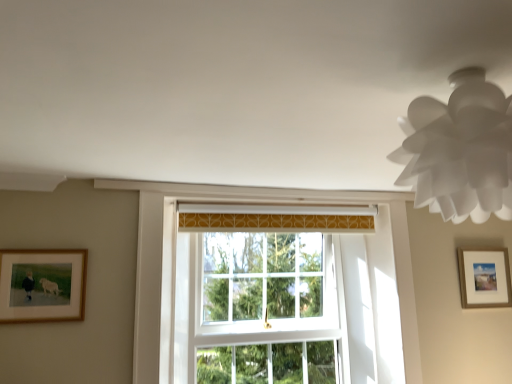
Question: Could you tell me if wooden framed picture at right, the first picture frame when ordered from back to front, is turned towards white paper lampshade at upper right?

Choices:
 (A) no
 (B) yes

Answer: (A)

Question: Would you say wooden framed picture at right, the second picture frame viewed from the left, contains white paper lampshade at upper right?

Choices:
 (A) no
 (B) yes

Answer: (A)

Question: Is wooden framed picture at right, the second picture frame viewed from the left, in front of white paper lampshade at upper right?

Choices:
 (A) no
 (B) yes

Answer: (A)

Question: Does wooden framed picture at right, the second picture frame viewed from the left, have a smaller size compared to white paper lampshade at upper right?

Choices:
 (A) yes
 (B) no

Answer: (A)

Question: Can you confirm if wooden framed picture at right, the second picture frame viewed from the left, is shorter than white paper lampshade at upper right?

Choices:
 (A) yes
 (B) no

Answer: (B)

Question: Is white glass window at center to the left or to the right of wooden framed picture at right, the first picture frame when ordered from back to front, in the image?

Choices:
 (A) right
 (B) left

Answer: (B)

Question: Is white glass window at center inside the boundaries of wooden framed picture at right, the first picture frame when ordered from back to front, or outside?

Choices:
 (A) outside
 (B) inside

Answer: (A)

Question: Is white glass window at center taller or shorter than wooden framed picture at right, positioned as the 2th picture frame in front-to-back order?

Choices:
 (A) short
 (B) tall

Answer: (B)

Question: In the image, is white glass window at center positioned in front of or behind wooden framed picture at right, the 1th picture frame positioned from the right?

Choices:
 (A) behind
 (B) front

Answer: (B)

Question: In the image, is wooden framed picture at right, the 1th picture frame positioned from the right, on the left side or the right side of wooden framed picture at left, which is the first picture frame in front-to-back order?

Choices:
 (A) right
 (B) left

Answer: (A)

Question: From the image's perspective, is wooden framed picture at right, positioned as the 2th picture frame in front-to-back order, above or below wooden framed picture at left, acting as the second picture frame starting from the back?

Choices:
 (A) above
 (B) below

Answer: (B)

Question: From a real-world perspective, is wooden framed picture at right, positioned as the 2th picture frame in front-to-back order, physically located above or below wooden framed picture at left, acting as the second picture frame starting from the back?

Choices:
 (A) above
 (B) below

Answer: (B)

Question: Does point (479, 256) appear closer or farther from the camera than point (0, 306)?

Choices:
 (A) closer
 (B) farther

Answer: (B)

Question: Would you say wooden framed picture at right, the 1th picture frame positioned from the right, is inside or outside white paper lampshade at upper right?

Choices:
 (A) inside
 (B) outside

Answer: (B)

Question: Is wooden framed picture at right, the second picture frame viewed from the left, in front of or behind white paper lampshade at upper right in the image?

Choices:
 (A) front
 (B) behind

Answer: (B)